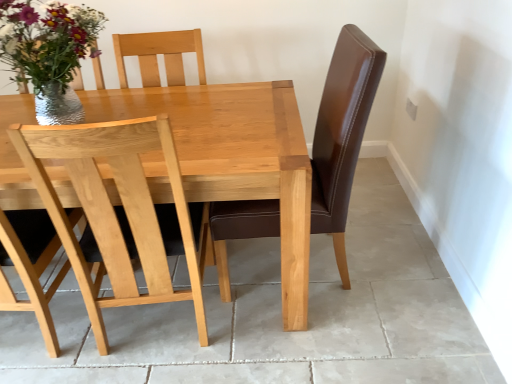
At what (x,y) coordinates should I click in order to perform the action: click on vacant area that lies to the right of shiny metallic vase at upper left. Please return your answer as a coordinate pair (x, y). Looking at the image, I should click on (185, 112).